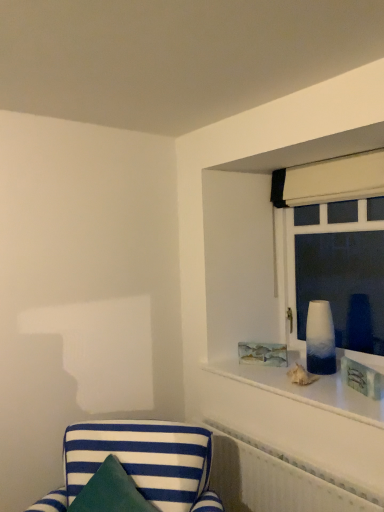
Describe the element at coordinates (263, 354) in the screenshot. I see `matte wooden picture frame at upper right` at that location.

In order to face white textured radiator at lower right, should I rotate leftwards or rightwards?

You should look right and rotate roughly 10.748 degrees.

The image size is (384, 512). What do you see at coordinates (320, 339) in the screenshot? I see `white gradient glass vase at right` at bounding box center [320, 339].

Locate an element on the screen. Image resolution: width=384 pixels, height=512 pixels. blue and white striped fabric chair at lower left is located at coordinates point(140,463).

The image size is (384, 512). I want to click on matte wooden picture frame at upper right, so click(263, 354).

Does white gradient glass vase at right have a lesser height compared to blue and white striped fabric chair at lower left?

Yes, white gradient glass vase at right is shorter than blue and white striped fabric chair at lower left.

Locate an element on the screen. The image size is (384, 512). table lamp on the right of the blue and white striped fabric chair at lower left is located at coordinates (320, 339).

Which object is positioned more to the left, white gradient glass vase at right or blue and white striped fabric chair at lower left?

blue and white striped fabric chair at lower left.

Is white gradient glass vase at right not within blue and white striped fabric chair at lower left?

Yes, white gradient glass vase at right is outside of blue and white striped fabric chair at lower left.

Can you confirm if white fabric curtain at upper right is positioned to the left of white textured radiator at lower right?

No.

Can you tell me how much white fabric curtain at upper right and white textured radiator at lower right differ in facing direction?

The facing directions of white fabric curtain at upper right and white textured radiator at lower right are 1.12 degrees apart.

From a real-world perspective, between white fabric curtain at upper right and white textured radiator at lower right, who is vertically lower?

In real-world perspective, white textured radiator at lower right is lower.

From the picture: Between white fabric curtain at upper right and white textured radiator at lower right, which one has smaller width?

white fabric curtain at upper right is thinner.

Looking at this image, who is smaller, white textured radiator at lower right or blue and white striped fabric chair at lower left?

white textured radiator at lower right.

From a real-world perspective, which object rests below the other?

From a 3D spatial view, white textured radiator at lower right is below.

From the image's perspective, which one is positioned lower, white textured radiator at lower right or blue and white striped fabric chair at lower left?

white textured radiator at lower right appears lower in the image.

Is white textured radiator at lower right in front of or behind blue and white striped fabric chair at lower left in the image?

white textured radiator at lower right is behind blue and white striped fabric chair at lower left.

Which object is further away from the camera taking this photo, white textured radiator at lower right or white fabric curtain at upper right?

white fabric curtain at upper right is more distant.

Which of these two, white textured radiator at lower right or white fabric curtain at upper right, is smaller?

Smaller between the two is white fabric curtain at upper right.

From the image's perspective, is white textured radiator at lower right above white fabric curtain at upper right?

No, from the image's perspective, white textured radiator at lower right is not on top of white fabric curtain at upper right.

Is point (258, 450) closer to viewer compared to point (331, 192)?

Yes.

I want to click on furniture below the matte wooden picture frame at upper right (from the image's perspective), so click(140, 463).

How different are the orientations of blue and white striped fabric chair at lower left and matte wooden picture frame at upper right in degrees?

There is a 12.6-degree angle between the facing directions of blue and white striped fabric chair at lower left and matte wooden picture frame at upper right.

Considering the relative positions of blue and white striped fabric chair at lower left and matte wooden picture frame at upper right in the image provided, is blue and white striped fabric chair at lower left behind matte wooden picture frame at upper right?

No, blue and white striped fabric chair at lower left is in front of matte wooden picture frame at upper right.

From the image's perspective, relative to matte wooden picture frame at upper right, is blue and white striped fabric chair at lower left above or below?

From the image's perspective, blue and white striped fabric chair at lower left appears below matte wooden picture frame at upper right.

Is ombre glass vase at upper right smaller than white textured radiator at lower right?

Yes.

From the image's perspective, relative to white textured radiator at lower right, is ombre glass vase at upper right above or below?

ombre glass vase at upper right is above white textured radiator at lower right.

Looking at their sizes, would you say ombre glass vase at upper right is wider or thinner than white textured radiator at lower right?

ombre glass vase at upper right is thinner than white textured radiator at lower right.

Is ombre glass vase at upper right inside the boundaries of white fabric curtain at upper right, or outside?

ombre glass vase at upper right cannot be found inside white fabric curtain at upper right.

From a real-world perspective, is ombre glass vase at upper right above or below white fabric curtain at upper right?

Clearly, from a real-world perspective, ombre glass vase at upper right is below white fabric curtain at upper right.

Who is taller, ombre glass vase at upper right or white fabric curtain at upper right?

ombre glass vase at upper right is taller.

Identify the location of curtain above the ombre glass vase at upper right (from a real-world perspective). (330, 180).

You are a GUI agent. You are given a task and a screenshot of the screen. Output one action in this format:
    pyautogui.click(x=<x>, y=<y>)
    Task: Click on the furniture below the white gradient glass vase at right (from the image's perspective)
    
    Given the screenshot: What is the action you would take?
    pyautogui.click(x=140, y=463)

Where is `curtain above the white textured radiator at lower right (from the image's perspective)`? The height and width of the screenshot is (512, 384). curtain above the white textured radiator at lower right (from the image's perspective) is located at coordinates point(330,180).

Based on their spatial positions, is white gradient glass vase at right or white textured radiator at lower right closer to blue and white striped fabric chair at lower left?

Based on the image, white textured radiator at lower right appears to be nearer to blue and white striped fabric chair at lower left.

Based on their spatial positions, is matte wooden picture frame at upper right or blue and white striped fabric chair at lower left closer to white fabric curtain at upper right?

Based on the image, matte wooden picture frame at upper right appears to be nearer to white fabric curtain at upper right.

Which object lies nearer to the anchor point white textured radiator at lower right, white fabric curtain at upper right or matte wooden picture frame at upper right?

The object closer to white textured radiator at lower right is matte wooden picture frame at upper right.

Estimate the real-world distances between objects in this image. Which object is further from white textured radiator at lower right, ombre glass vase at upper right or matte wooden picture frame at upper right?

The object further to white textured radiator at lower right is ombre glass vase at upper right.

Based on their spatial positions, is white gradient glass vase at right or blue and white striped fabric chair at lower left further from white fabric curtain at upper right?

The object further to white fabric curtain at upper right is blue and white striped fabric chair at lower left.

From the image, which object appears to be nearer to white textured radiator at lower right, blue and white striped fabric chair at lower left or ombre glass vase at upper right?

The object closer to white textured radiator at lower right is blue and white striped fabric chair at lower left.

Considering their positions, is white fabric curtain at upper right positioned further to blue and white striped fabric chair at lower left than ombre glass vase at upper right?

Based on the image, white fabric curtain at upper right appears to be further to blue and white striped fabric chair at lower left.

Looking at the image, which one is located further to white fabric curtain at upper right, blue and white striped fabric chair at lower left or matte wooden picture frame at upper right?

blue and white striped fabric chair at lower left is positioned further to the anchor white fabric curtain at upper right.

This screenshot has width=384, height=512. In order to click on table lamp that lies between white fabric curtain at upper right and blue and white striped fabric chair at lower left from top to bottom in this screenshot , I will do `click(320, 339)`.

Locate an element on the screen. Image resolution: width=384 pixels, height=512 pixels. window between white fabric curtain at upper right and white textured radiator at lower right in the up-down direction is located at coordinates (334, 248).

In order to click on furniture between white fabric curtain at upper right and white textured radiator at lower right vertically in this screenshot , I will do `click(140, 463)`.

The width and height of the screenshot is (384, 512). I want to click on table lamp between white textured radiator at lower right and matte wooden picture frame at upper right from front to back, so click(x=320, y=339).